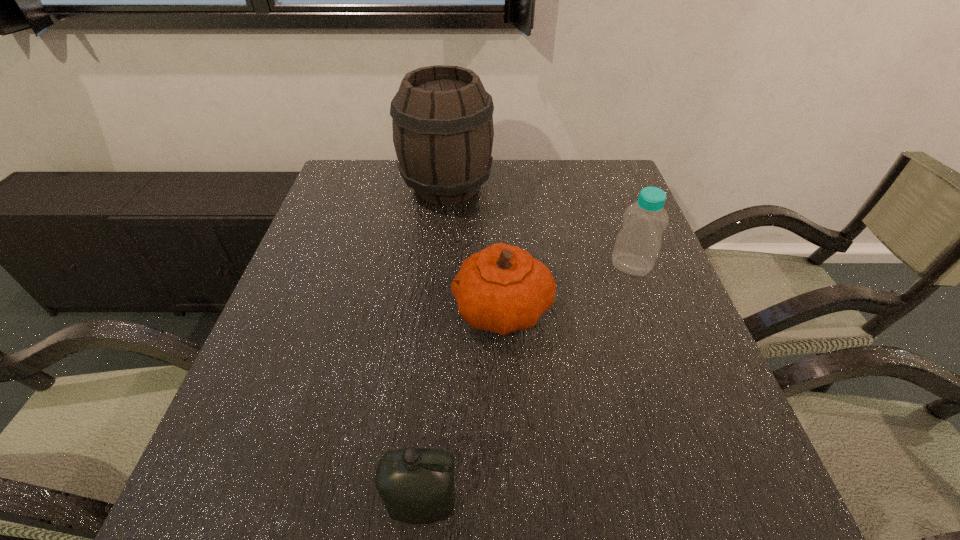
Find the location of a particular element. The height and width of the screenshot is (540, 960). free location located on the front-facing side of the pumpkin is located at coordinates (314, 309).

Identify the location of vacant area situated on the front-facing side of the pumpkin. (421, 309).

You are a GUI agent. You are given a task and a screenshot of the screen. Output one action in this format:
    pyautogui.click(x=<x>, y=<y>)
    Task: Click on the free point located on the right of the shorter bottle
    Image resolution: width=960 pixels, height=540 pixels.
    Given the screenshot: What is the action you would take?
    pyautogui.click(x=509, y=504)

At what (x,y) coordinates should I click in order to perform the action: click on object that is at the far edge. Please return your answer as a coordinate pair (x, y). This screenshot has height=540, width=960. Looking at the image, I should click on click(443, 132).

Where is `object present at the near edge`? The width and height of the screenshot is (960, 540). object present at the near edge is located at coordinates (416, 485).

Where is `object present at the right edge`? The height and width of the screenshot is (540, 960). object present at the right edge is located at coordinates (637, 245).

The height and width of the screenshot is (540, 960). Identify the location of free spot at the far edge of the desktop. (496, 190).

The height and width of the screenshot is (540, 960). I want to click on free space at the near edge of the desktop, so click(x=615, y=521).

Identify the location of vacant space at the left edge of the desktop. (348, 289).

In the image, there is a desktop. Where is `vacant space at the right edge`? vacant space at the right edge is located at coordinates (598, 234).